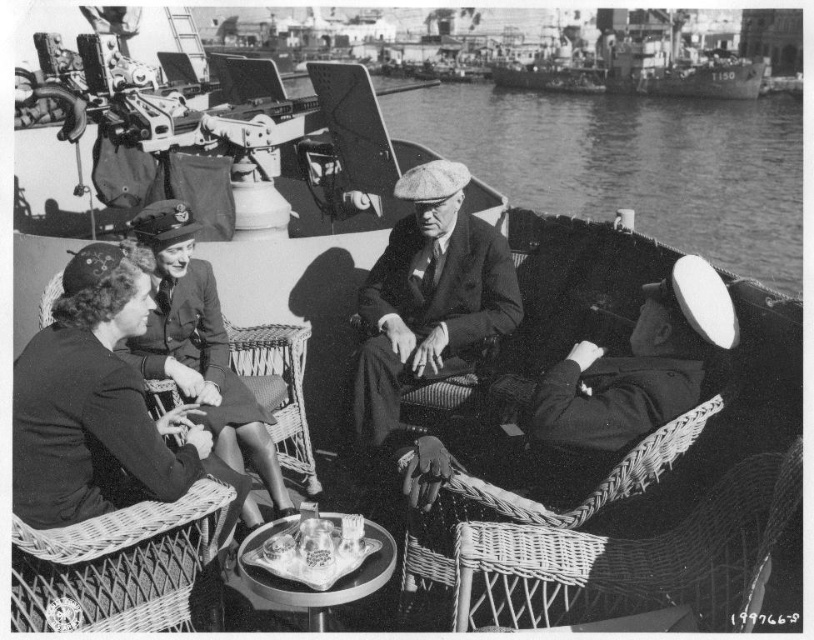
Question: Does clear water at center have a larger size compared to matte black uniform at center?

Choices:
 (A) no
 (B) yes

Answer: (B)

Question: Can you confirm if dark woolen coat at lower left is positioned above matte black uniform at center?

Choices:
 (A) no
 (B) yes

Answer: (A)

Question: Which point is closer to the camera?

Choices:
 (A) [x=366, y=344]
 (B) [x=191, y=426]
 (C) [x=633, y=168]

Answer: (B)

Question: Can you confirm if clear water at center is positioned above dark woolen coat at lower left?

Choices:
 (A) no
 (B) yes

Answer: (B)

Question: Which object is positioned closest to the clear water at center?

Choices:
 (A) matte black uniform at center
 (B) dark woolen coat at lower left

Answer: (A)

Question: Which of these objects is positioned closest to the dark woolen coat at lower left?

Choices:
 (A) clear water at center
 (B) matte black uniform at center
 (C) matte black suit at center

Answer: (B)